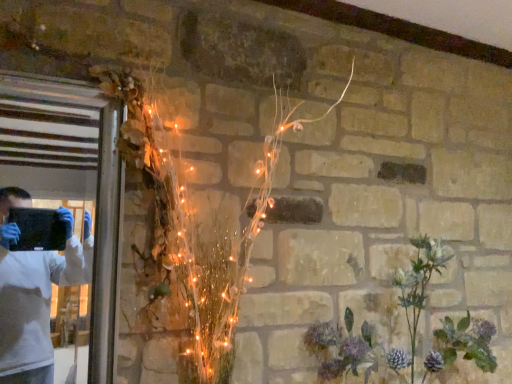
Describe the element at coordinates (374, 327) in the screenshot. The image size is (512, 384). I see `purple matte floral arrangement at lower right` at that location.

In order to face purple matte floral arrangement at lower right, should I rotate leftwards or rightwards?

A 20.305 degree turn to the right will do.

Where is `purple matte floral arrangement at lower right`? This screenshot has height=384, width=512. purple matte floral arrangement at lower right is located at coordinates (374, 327).

What is the approximate height of purple matte floral arrangement at lower right?

purple matte floral arrangement at lower right is 21.60 inches tall.

I want to click on purple matte floral arrangement at lower right, so pyautogui.click(x=374, y=327).